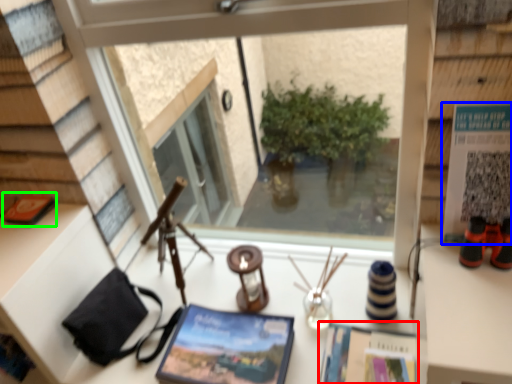
Question: Which object is positioned closest to magazine (highlighted by a red box)? Select from paperback book (highlighted by a blue box) and book (highlighted by a green box).

Choices:
 (A) paperback book
 (B) book

Answer: (A)